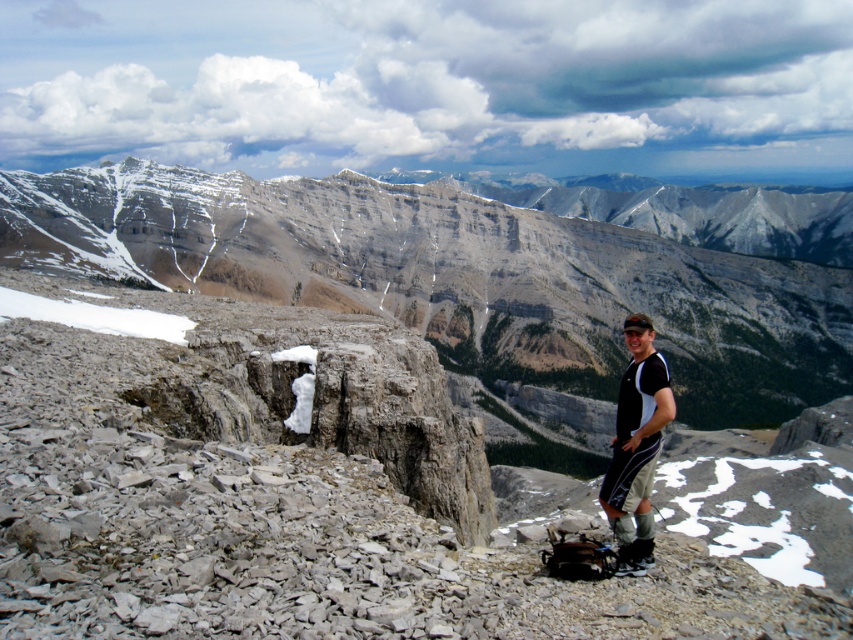
You are a hiker who wants to take a photo of the gray rocky cliff at center and the black fabric shirt at right. Which object should you focus on first if you want both to be in clear focus?

The gray rocky cliff at center is bigger than the black fabric shirt at right, so you should focus on the gray rocky cliff at center first to ensure both are in clear focus.

You are a hiker planning to climb the gray rocky cliff at center and the black fabric shirt at right. Which object is taller and requires more climbing effort?

The gray rocky cliff at center is taller than the black fabric shirt at right, so it requires more climbing effort.